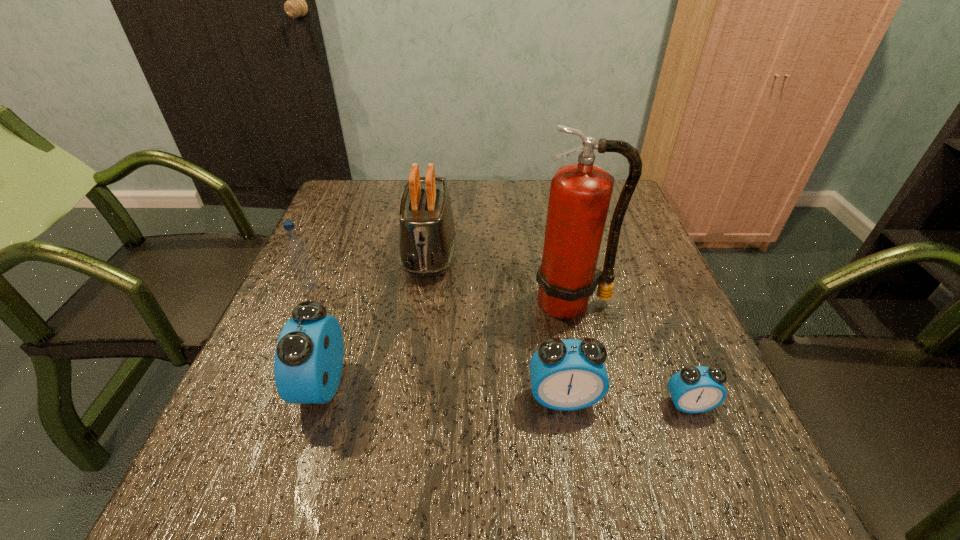
Locate an element on the screen. The width and height of the screenshot is (960, 540). vacant space situated on the face of the fifth object from right to left is located at coordinates (251, 385).

Image resolution: width=960 pixels, height=540 pixels. I want to click on free spot located 0.050m on the face of the rightmost alarm clock, so click(x=704, y=441).

You are a GUI agent. You are given a task and a screenshot of the screen. Output one action in this format:
    pyautogui.click(x=<x>, y=<y>)
    Task: Click on the vacant area situated 0.180m at the nozzle of the fire extinguisher
    
    Given the screenshot: What is the action you would take?
    pyautogui.click(x=592, y=396)

This screenshot has height=540, width=960. I want to click on free space located 0.360m on the side of the toaster with the control lever, so click(405, 424).

Where is `vacant space located on the back of the leftmost object`? This screenshot has width=960, height=540. vacant space located on the back of the leftmost object is located at coordinates (336, 226).

Find the location of a particular element. This screenshot has width=960, height=540. alarm clock located at the left edge is located at coordinates (308, 362).

Image resolution: width=960 pixels, height=540 pixels. Identify the location of water bottle present at the left edge. (296, 248).

The height and width of the screenshot is (540, 960). I want to click on alarm clock present at the right edge, so click(698, 389).

Locate an element on the screen. This screenshot has height=540, width=960. fire extinguisher located at the right edge is located at coordinates (580, 193).

Image resolution: width=960 pixels, height=540 pixels. What are the coordinates of `object located in the near left corner section of the desktop` in the screenshot? It's located at (308, 362).